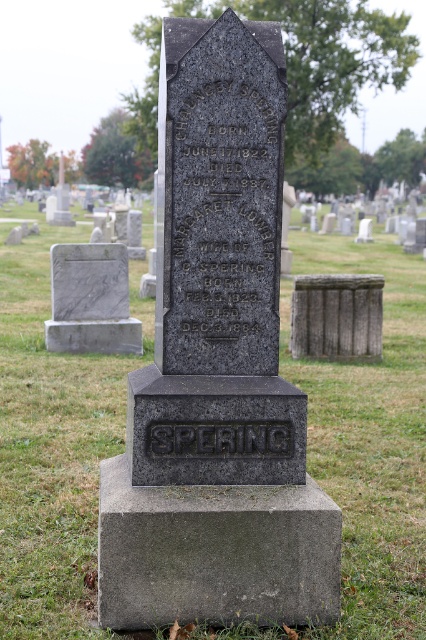
Question: Based on their relative distances, which object is nearer to the gray stone box at center?

Choices:
 (A) black granite stone at center
 (B) white marble gravestone at left
 (C) green grass at center
 (D) granite gravestone at center

Answer: (B)

Question: Does black granite stone at center have a lesser width compared to gray stone box at center?

Choices:
 (A) yes
 (B) no

Answer: (A)

Question: Is green grass at center positioned at the back of granite gravestone at center?

Choices:
 (A) yes
 (B) no

Answer: (B)

Question: Is granite gravestone at center closer to camera compared to gray stone box at center?

Choices:
 (A) no
 (B) yes

Answer: (B)

Question: Which of these objects is positioned closest to the white marble gravestone at left?

Choices:
 (A) gray stone base at center
 (B) green grass at center

Answer: (B)

Question: Which object appears closest to the camera in this image?

Choices:
 (A) granite gravestone at center
 (B) black granite stone at center
 (C) green grass at center

Answer: (C)